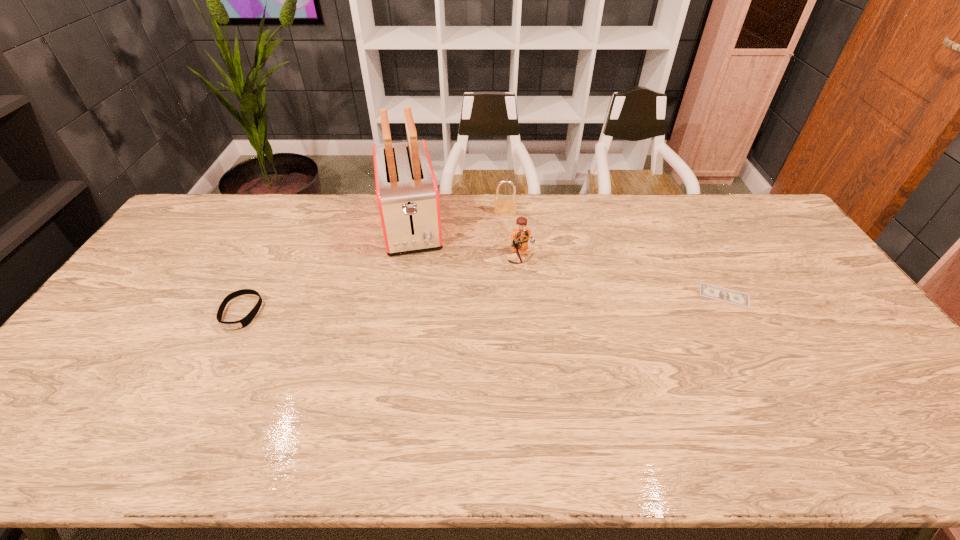
I want to click on vacant space on the desktop that is between the fourth tallest object and the shortest object and is positioned on the front-facing side of the padlock, so click(503, 303).

Where is `vacant space on the desktop that is between the leftmost object and the rightmost object and is positioned on the front-facing side of the toaster`? vacant space on the desktop that is between the leftmost object and the rightmost object and is positioned on the front-facing side of the toaster is located at coordinates (423, 306).

At what (x,y) coordinates should I click in order to perform the action: click on free space on the desktop that is between the wristband and the money and is positioned holding a crossbow in the hands of the Lego. Please return your answer as a coordinate pair (x, y). This screenshot has width=960, height=540. Looking at the image, I should click on point(550,301).